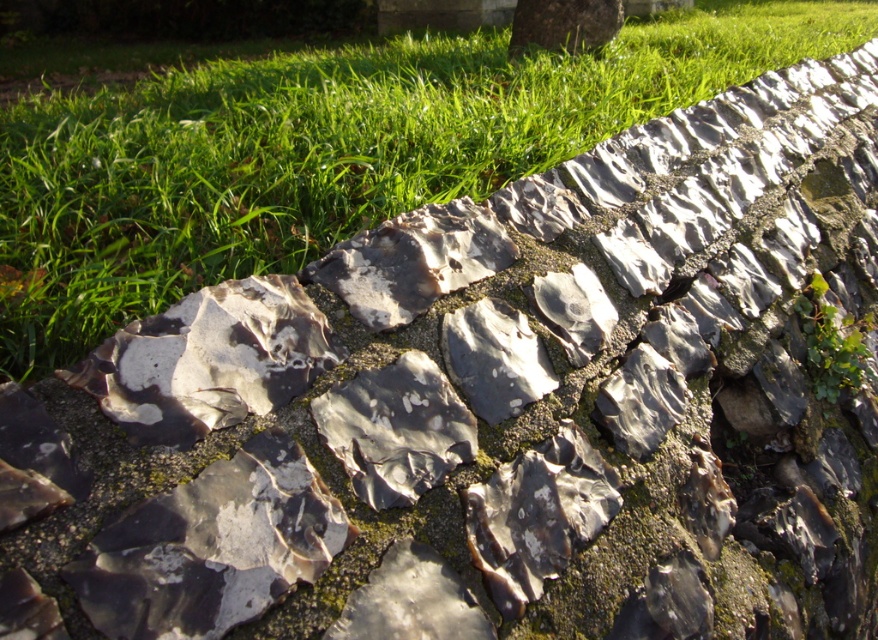
Question: In this image, where is green grass at upper center located relative to green leafy tree at upper center?

Choices:
 (A) above
 (B) below

Answer: (B)

Question: Does green grass at upper center appear on the right side of green leafy tree at upper center?

Choices:
 (A) yes
 (B) no

Answer: (B)

Question: Which of the following is the farthest from the observer?

Choices:
 (A) green grass at upper center
 (B) green leafy tree at upper center

Answer: (B)

Question: Which of the following is the farthest from the observer?

Choices:
 (A) (516, 45)
 (B) (263, 173)

Answer: (A)

Question: Is green grass at upper center below green leafy tree at upper center?

Choices:
 (A) yes
 (B) no

Answer: (A)